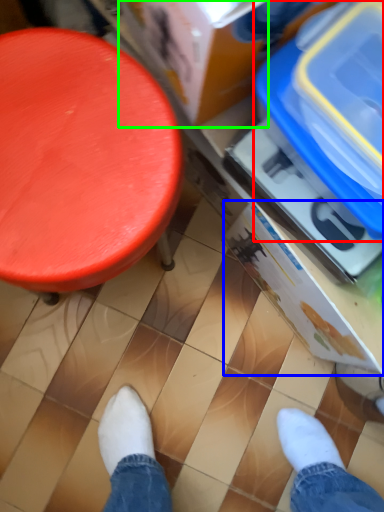
Question: Estimate the real-world distances between objects in this image. Which object is closer to storage box (highlighted by a red box), storage box (highlighted by a blue box) or storage box (highlighted by a green box)?

Choices:
 (A) storage box
 (B) storage box

Answer: (B)